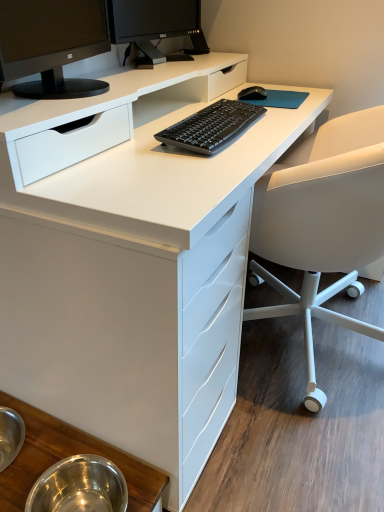
Question: Is black matte keyboard at center inside the boundaries of black glossy monitor at upper center, which ranks as the 1th computer monitor in back-to-front order, or outside?

Choices:
 (A) inside
 (B) outside

Answer: (B)

Question: Is point (185, 126) closer or farther from the camera than point (153, 50)?

Choices:
 (A) closer
 (B) farther

Answer: (A)

Question: Based on their relative distances, which object is nearer to the matte black monitor at upper left, the 2th computer monitor from the back?

Choices:
 (A) white matte office chair at right
 (B) black matte keyboard at center
 (C) metallic stainless steel bowls at lower left
 (D) black glossy monitor at upper center, which ranks as the 1th computer monitor in back-to-front order

Answer: (D)

Question: Which object is the farthest from the matte black monitor at upper left, the 1th computer monitor positioned from the front?

Choices:
 (A) black matte keyboard at center
 (B) black glossy monitor at upper center, marked as the 2th computer monitor in a front-to-back arrangement
 (C) white matte office chair at right
 (D) metallic stainless steel bowls at lower left

Answer: (D)